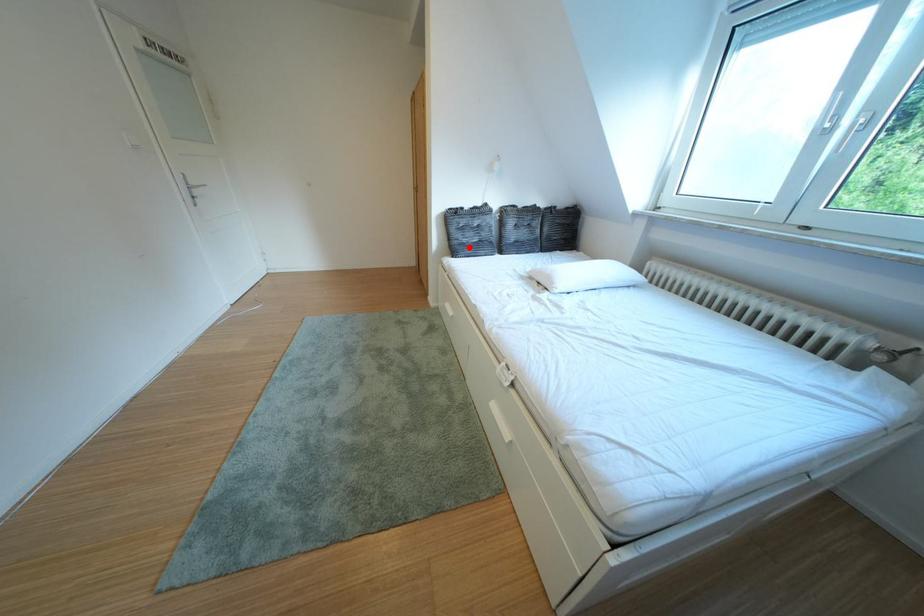
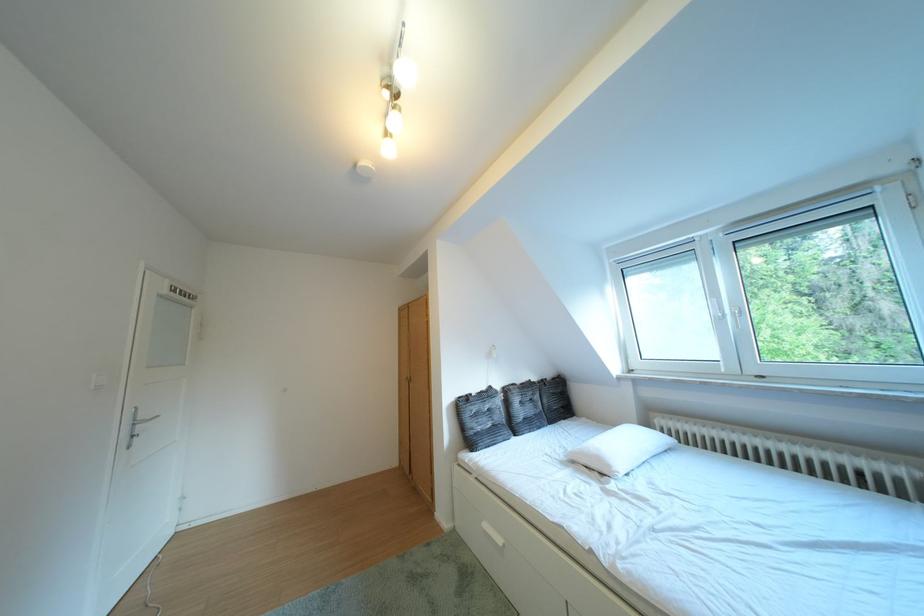
Question: A red point is marked in image1. In image2, is the corresponding 3D point closer to the camera or farther? Reply with the corresponding letter.

Choices:
 (A) The corresponding 3D point is closer.
 (B) The corresponding 3D point is farther.

Answer: (B)